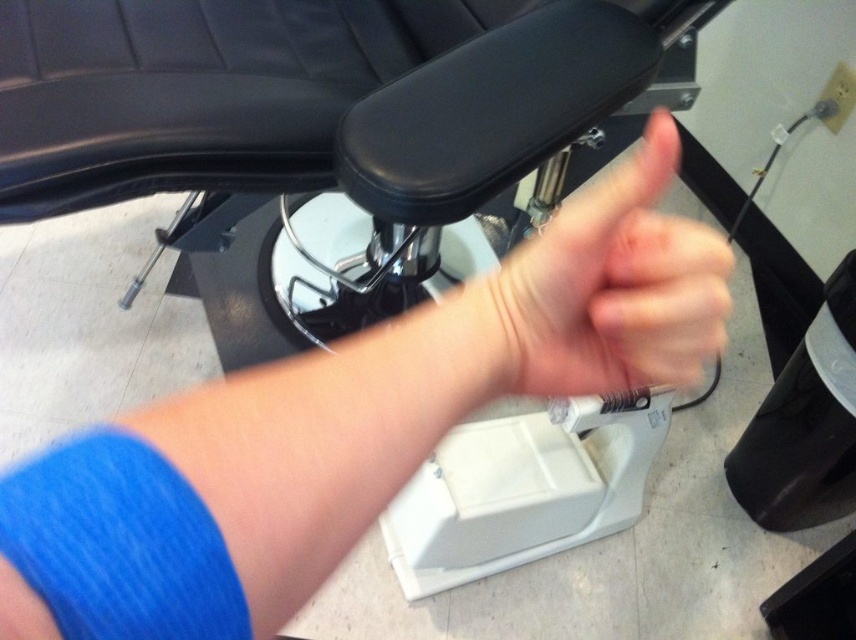
Which is below, blue fabric arm at center or skinny white hand at center?

blue fabric arm at center is below.

Is blue fabric arm at center shorter than skinny white hand at center?

Yes, blue fabric arm at center is shorter than skinny white hand at center.

Is point (80, 620) farther from viewer compared to point (563, 376)?

No, (80, 620) is closer to viewer.

Find the location of a particular element. The height and width of the screenshot is (640, 856). blue fabric arm at center is located at coordinates (351, 426).